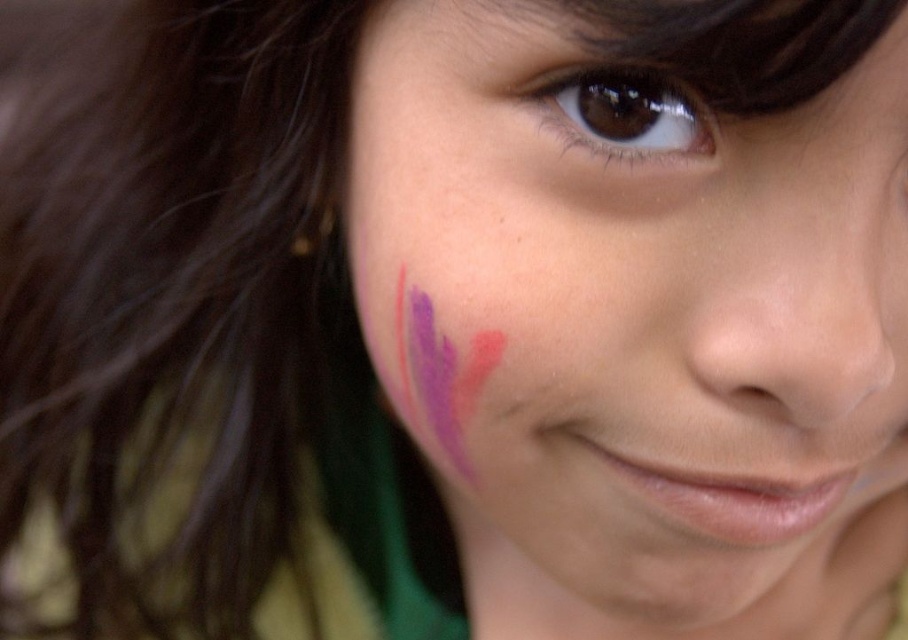
Question: Which of the following is the closest to the observer?

Choices:
 (A) (712, 147)
 (B) (361, 48)

Answer: (A)

Question: Can you confirm if purple matte paint at left is bigger than brown glossy eye at upper center?

Choices:
 (A) no
 (B) yes

Answer: (B)

Question: Where is purple matte paint at left located in relation to brown glossy eye at upper center in the image?

Choices:
 (A) below
 (B) above

Answer: (A)

Question: Does purple matte paint at left have a smaller size compared to brown glossy eye at upper center?

Choices:
 (A) yes
 (B) no

Answer: (B)

Question: Among these objects, which one is nearest to the camera?

Choices:
 (A) brown glossy eye at upper center
 (B) purple matte paint at left

Answer: (B)